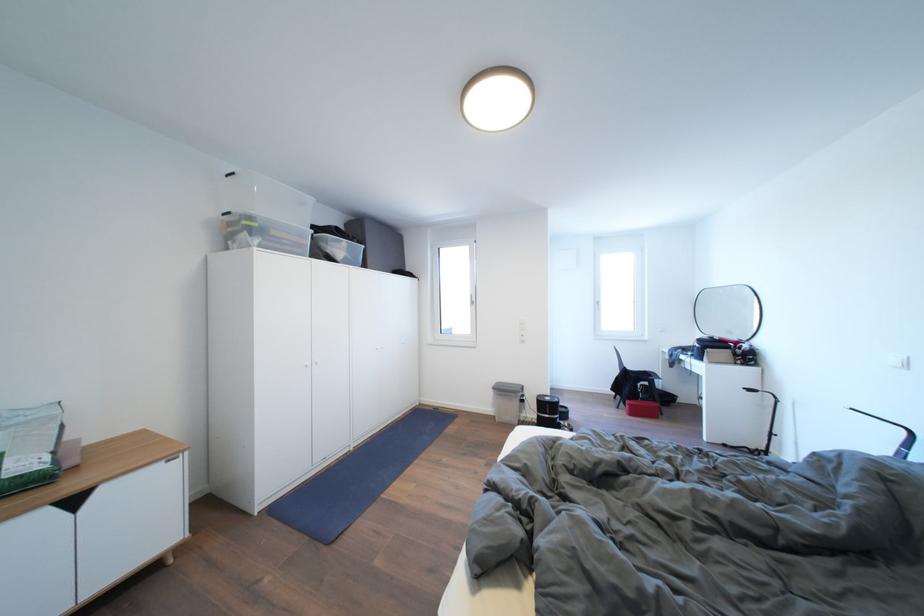
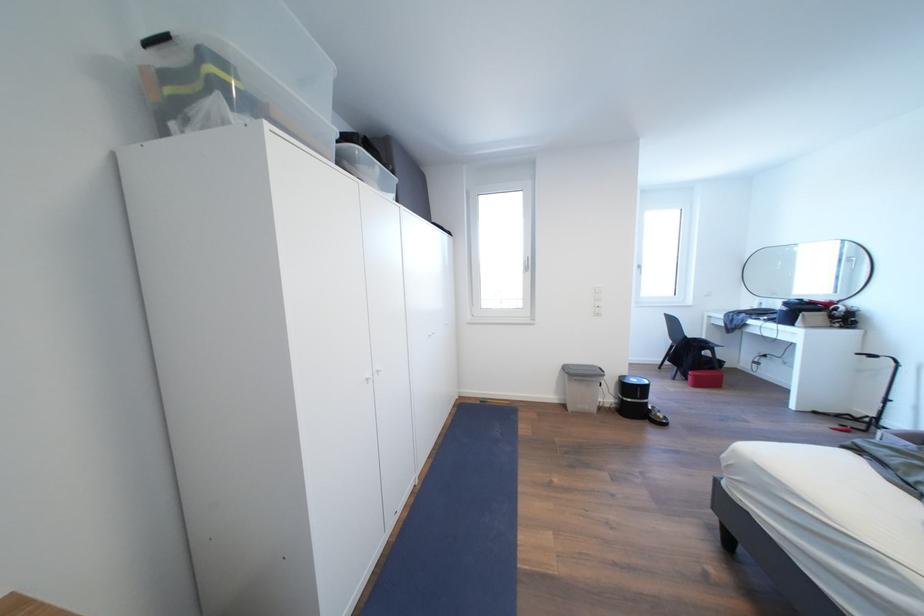
Consider the image. What movement of the cameraman would produce the second image?

The movement direction of the cameraman is left, forward.